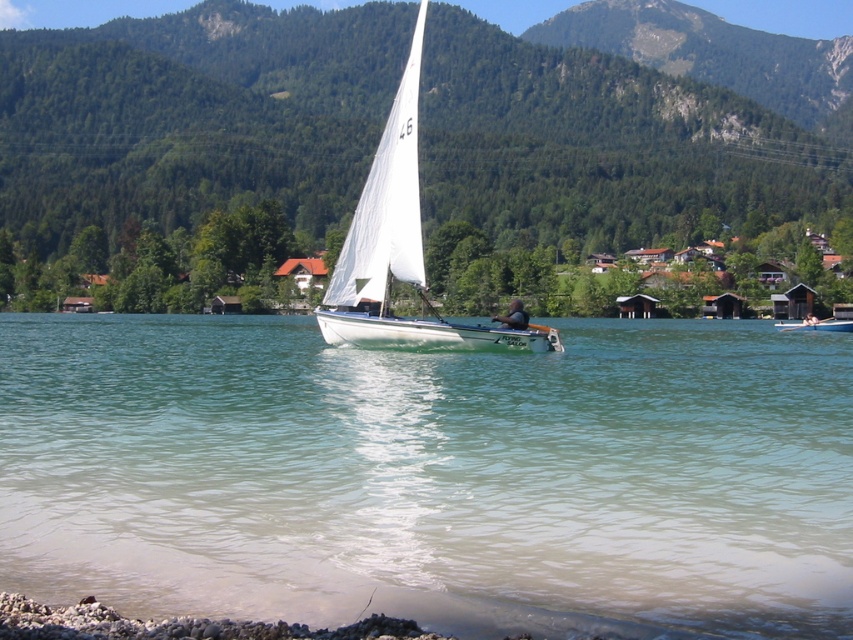
Question: Is clear water at center to the right of white sailboat at center from the viewer's perspective?

Choices:
 (A) yes
 (B) no

Answer: (B)

Question: Does smooth pebbles at lower left have a greater width compared to black fabric person at center?

Choices:
 (A) yes
 (B) no

Answer: (A)

Question: Which point is farther to the camera?

Choices:
 (A) clear water at center
 (B) white sailboat at center
 (C) black fabric person at center

Answer: (B)

Question: Which point is farther from the camera taking this photo?

Choices:
 (A) (784, 324)
 (B) (79, 628)
 (C) (517, 301)
 (D) (804, 324)

Answer: (A)

Question: Does white matte sailboat at center have a lesser width compared to black fabric person at center?

Choices:
 (A) no
 (B) yes

Answer: (A)

Question: Which point is farther to the camera?

Choices:
 (A) smooth skin person at center
 (B) white matte sailboat at center
 (C) green forested mountain at upper center

Answer: (C)